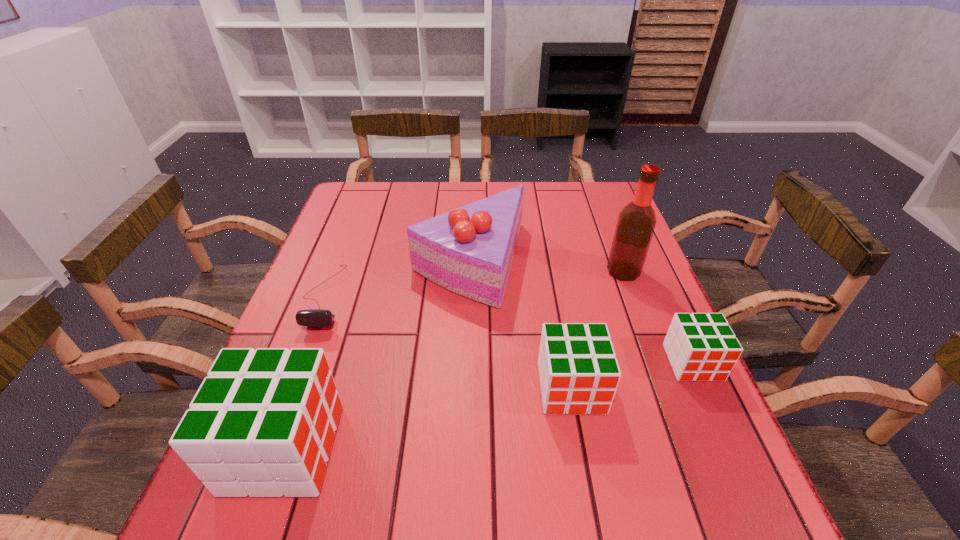
To make them evenly spaced by inserting another cube among them, please locate a free space for this new cube. Please provide its 2D coordinates. Your answer should be formatted as a tuple, i.e. [(x, y)], where the tuple contains the x and y coordinates of a point satisfying the conditions above.

[(436, 416)]